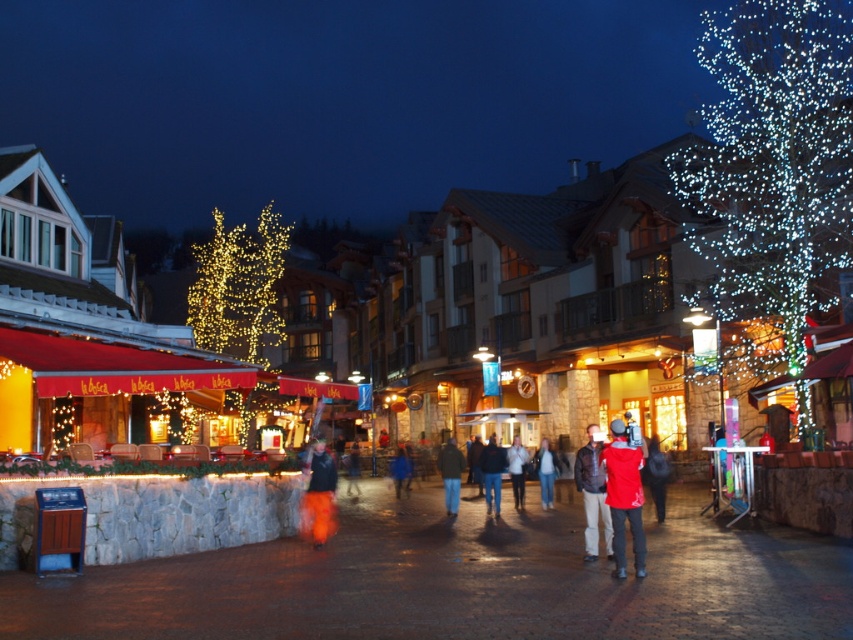
Is red fabric jacket at center wider than dark brown leather jacket at center?

No.

Who is taller, red fabric jacket at center or dark brown leather jacket at center?

Standing taller between the two is dark brown leather jacket at center.

The height and width of the screenshot is (640, 853). What are the coordinates of `red fabric jacket at center` in the screenshot? It's located at (624, 497).

Locate an element on the screen. The width and height of the screenshot is (853, 640). red fabric jacket at center is located at coordinates (624, 497).

Who is higher up, orange fabric pants at center or white cotton jacket at center?

orange fabric pants at center is higher up.

This screenshot has width=853, height=640. I want to click on orange fabric pants at center, so click(x=318, y=496).

I want to click on orange fabric pants at center, so click(318, 496).

Between red fabric jacket at center and red jacket at center, which one has more height?

red fabric jacket at center

Which is in front, point (630, 508) or point (523, 451)?

Point (630, 508) is in front.

The height and width of the screenshot is (640, 853). I want to click on red fabric jacket at center, so click(x=624, y=497).